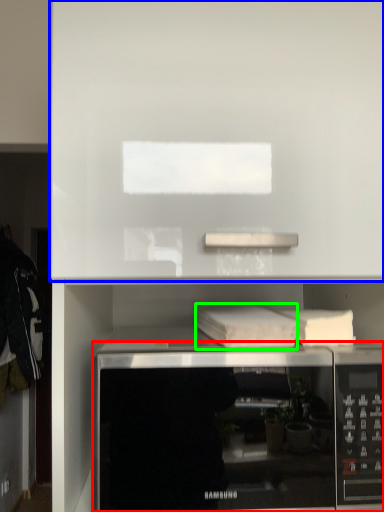
Question: Which object is the farthest from microwave oven (highlighted by a red box)? Choose among these: cabinet (highlighted by a blue box) or book (highlighted by a green box).

Choices:
 (A) cabinet
 (B) book

Answer: (A)